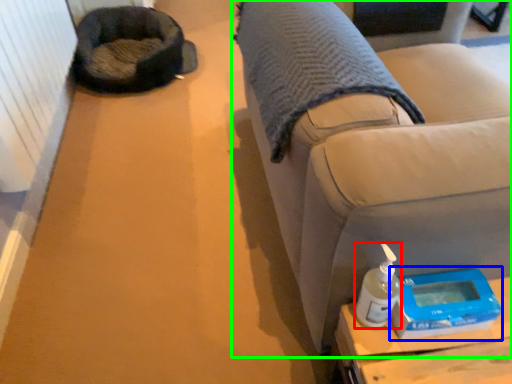
Question: Which object is the farthest from bottle (highlighted by a red box)? Choose among these: scale (highlighted by a blue box) or furniture (highlighted by a green box).

Choices:
 (A) scale
 (B) furniture

Answer: (B)